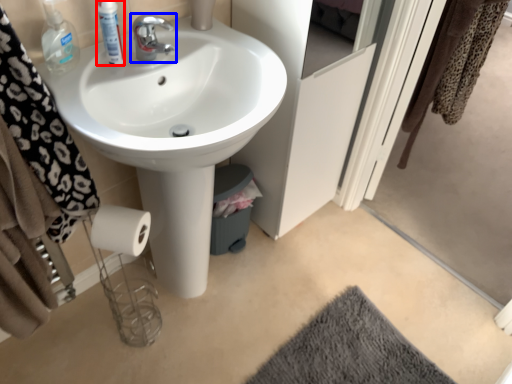
Question: Which object is further to the camera taking this photo, mouthwash (highlighted by a red box) or tap (highlighted by a blue box)?

Choices:
 (A) mouthwash
 (B) tap

Answer: (B)